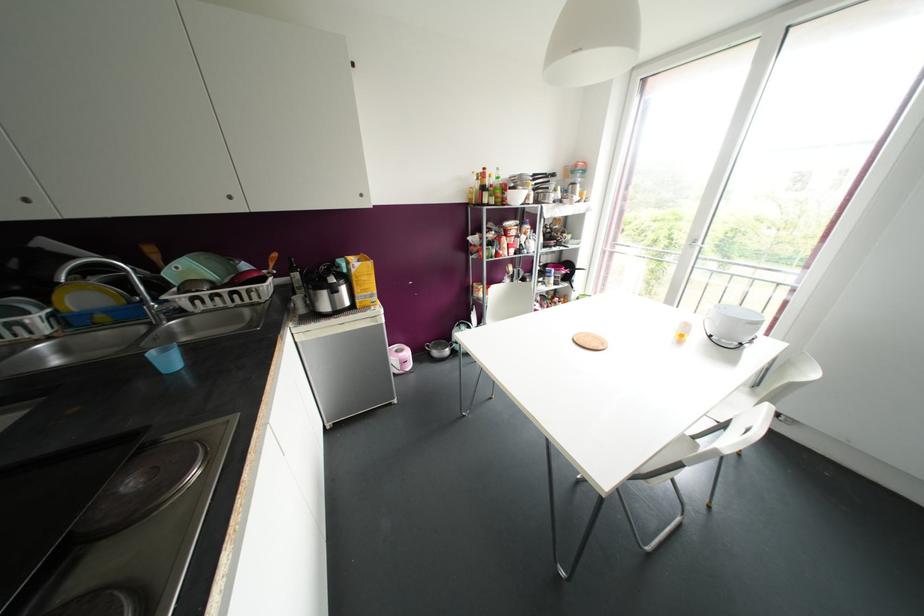
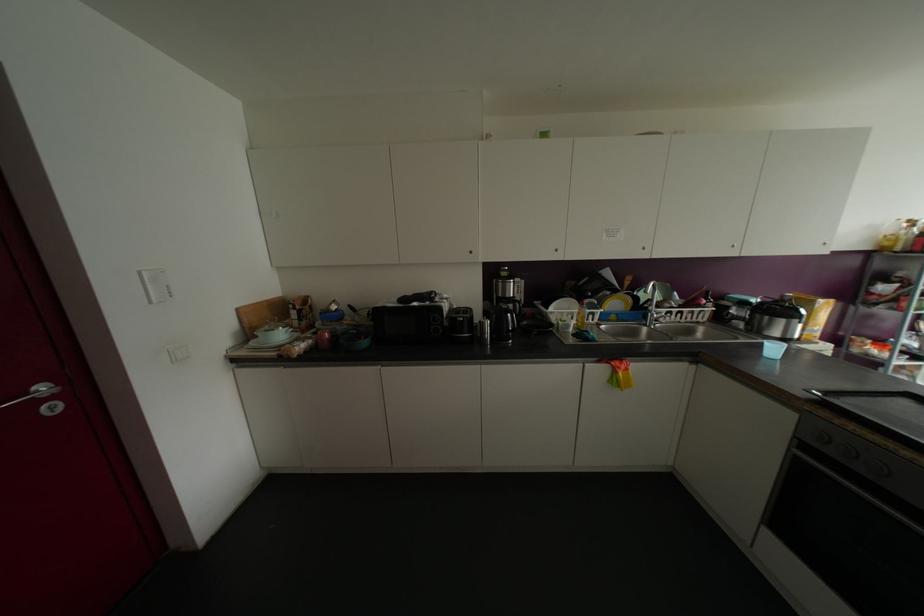
In the second image, find the point that corresponds to (x=27, y=200) in the first image.

(642, 248)